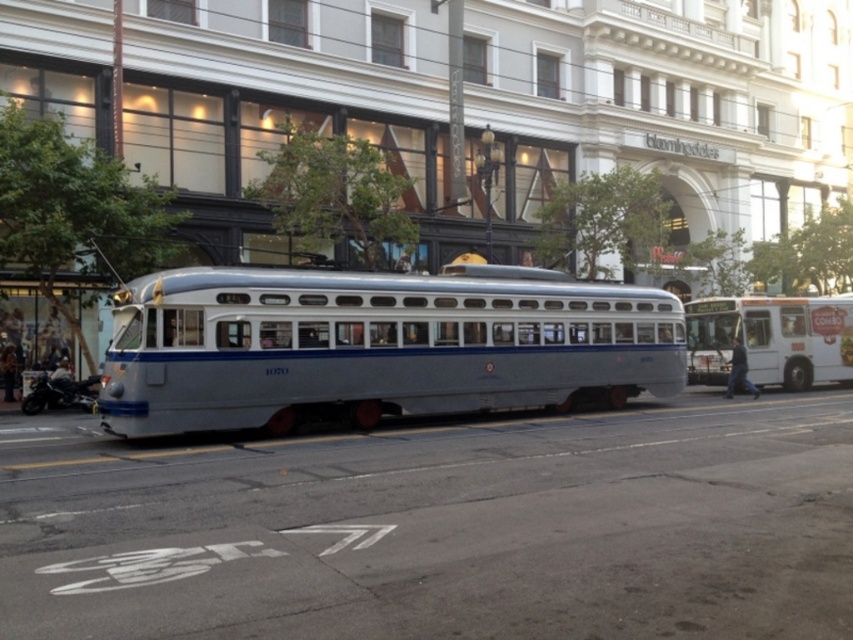
Is point (225, 374) closer to camera compared to point (692, 356)?

That is True.

Based on the photo, which of these two, silver polished tram at center or white matte bus at right, stands taller?

silver polished tram at center

This screenshot has height=640, width=853. I want to click on silver polished tram at center, so click(376, 346).